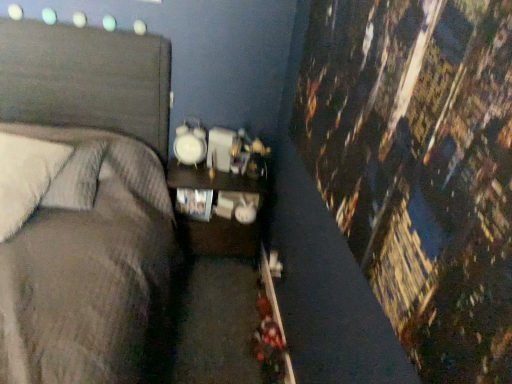
Question: Is white soft pillow at left, the first pillow positioned from the front, completely or partially outside of matte wood nightstand at center?

Choices:
 (A) yes
 (B) no

Answer: (A)

Question: Is white soft pillow at left, the first pillow positioned from the front, directly adjacent to matte wood nightstand at center?

Choices:
 (A) yes
 (B) no

Answer: (B)

Question: Is white soft pillow at left, the first pillow positioned from the front, thinner than matte wood nightstand at center?

Choices:
 (A) no
 (B) yes

Answer: (A)

Question: Is white soft pillow at left, the first pillow positioned from the front, turned away from matte wood nightstand at center?

Choices:
 (A) no
 (B) yes

Answer: (A)

Question: Does white soft pillow at left, the second pillow positioned from the back, appear on the right side of matte wood nightstand at center?

Choices:
 (A) no
 (B) yes

Answer: (A)

Question: Considering the relative sizes of white soft pillow at left, the second pillow positioned from the back, and matte wood nightstand at center in the image provided, is white soft pillow at left, the second pillow positioned from the back, smaller than matte wood nightstand at center?

Choices:
 (A) yes
 (B) no

Answer: (A)

Question: From a real-world perspective, is matte wood nightstand at center positioned under white soft pillow at left, the second pillow positioned from the back, based on gravity?

Choices:
 (A) no
 (B) yes

Answer: (B)

Question: Is matte wood nightstand at center oriented towards white soft pillow at left, the second pillow positioned from the back?

Choices:
 (A) yes
 (B) no

Answer: (B)

Question: Is the depth of matte wood nightstand at center less than that of white soft pillow at left, the second pillow positioned from the back?

Choices:
 (A) no
 (B) yes

Answer: (A)

Question: Does matte wood nightstand at center have a smaller size compared to white soft pillow at left, the first pillow positioned from the front?

Choices:
 (A) no
 (B) yes

Answer: (A)

Question: From a real-world perspective, is matte wood nightstand at center positioned over white soft pillow at left, the first pillow positioned from the front, based on gravity?

Choices:
 (A) yes
 (B) no

Answer: (B)

Question: Is matte wood nightstand at center surrounding white soft pillow at left, the second pillow positioned from the back?

Choices:
 (A) no
 (B) yes

Answer: (A)

Question: Can you confirm if white soft pillow at left, which ranks as the 1th pillow in back-to-front order, is thinner than matte wood nightstand at center?

Choices:
 (A) no
 (B) yes

Answer: (A)